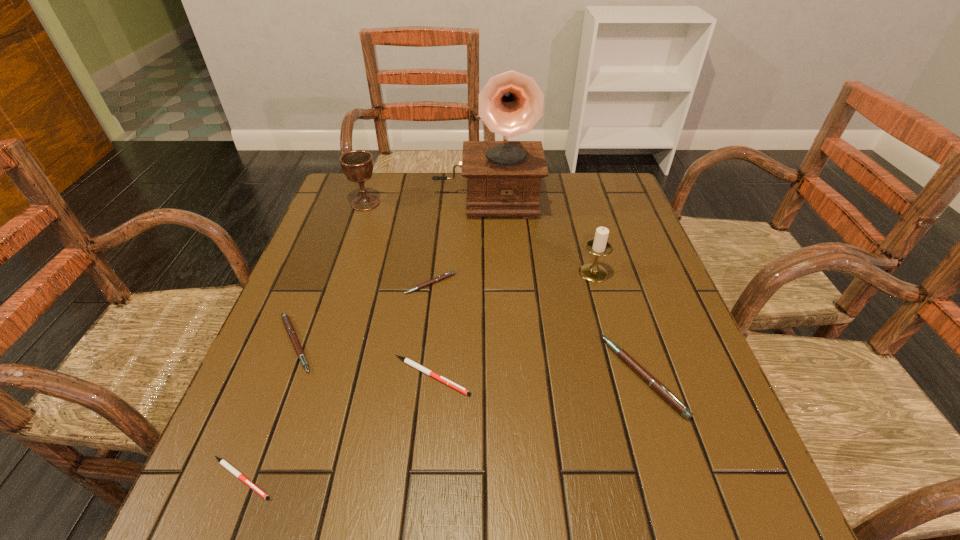
Identify which object is the sixth nearest to the farthest pen. Please provide its 2D coordinates. Your answer should be formatted as a tuple, i.e. [(x, y)], where the tuple contains the x and y coordinates of a point satisfying the conditions above.

[(655, 384)]

Locate which pen is the third closest to the nearest pen. Please provide its 2D coordinates. Your answer should be formatted as a tuple, i.e. [(x, y)], where the tuple contains the x and y coordinates of a point satisfying the conditions above.

[(450, 273)]

Locate an element on the screen. The height and width of the screenshot is (540, 960). pen object that ranks as the fourth closest to the right white pen is located at coordinates (655, 384).

This screenshot has width=960, height=540. What are the coordinates of `pink pen that is the closest to the tallest object` in the screenshot? It's located at [x=450, y=273].

Where is `pink pen that is the second closest to the tallest object`? The height and width of the screenshot is (540, 960). pink pen that is the second closest to the tallest object is located at coordinates (288, 325).

What are the coordinates of `free space that satisfies the following two spatial constraints: 1. on the horn of the record player; 2. on the clicker of the right white pen` in the screenshot? It's located at (490, 376).

Locate an element on the screen. This screenshot has height=540, width=960. vacant space that satisfies the following two spatial constraints: 1. on the horn of the brown record player; 2. at the nib of the second biggest pink pen is located at coordinates (489, 343).

Where is `vacant space that satisfies the following two spatial constraints: 1. on the front side of the candle holder; 2. on the clicker of the smaller white pen`? The width and height of the screenshot is (960, 540). vacant space that satisfies the following two spatial constraints: 1. on the front side of the candle holder; 2. on the clicker of the smaller white pen is located at coordinates (651, 478).

Where is `free point that satisfies the following two spatial constraints: 1. at the nib of the smallest pink pen; 2. at the nib of the second tallest pen`? Image resolution: width=960 pixels, height=540 pixels. free point that satisfies the following two spatial constraints: 1. at the nib of the smallest pink pen; 2. at the nib of the second tallest pen is located at coordinates (423, 343).

I want to click on free spot that satisfies the following two spatial constraints: 1. on the horn of the brown record player; 2. at the nib of the leftmost pink pen, so click(489, 343).